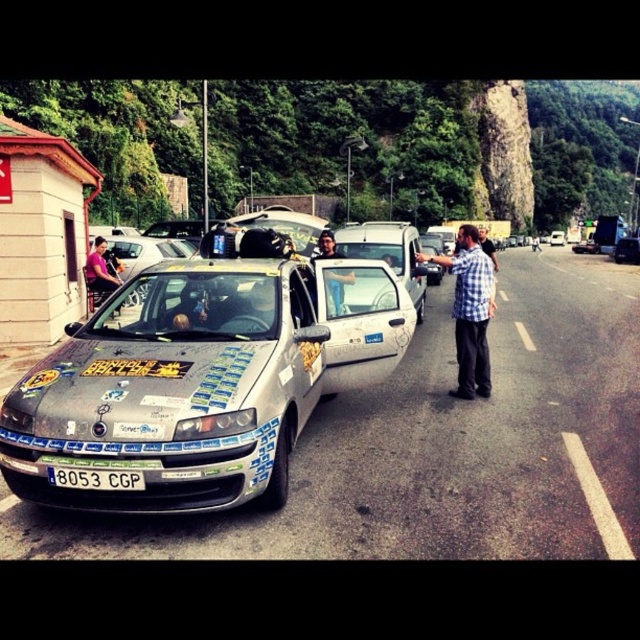
You are a photographer trying to capture a photo of the silver metallic hatchback at center and the matte black shirt at left. Since you want to emphasize the hatchback, which object should you place closer to the camera?

The silver metallic hatchback at center is larger than the matte black shirt at left, so to emphasize it, you should place the silver metallic hatchback at center closer to the camera.

You are a photographer trying to capture a photo of the scratched metallic taxi at left and the white matte van at center. Which vehicle should you position your camera lower to frame properly?

The scratched metallic taxi at left is not as tall as the white matte van at center, so you should position your camera lower to frame the scratched metallic taxi at left properly.